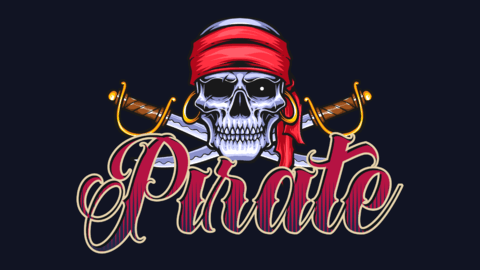
Identify the location of handles. This screenshot has width=480, height=270. pyautogui.click(x=334, y=111), pyautogui.click(x=137, y=107).